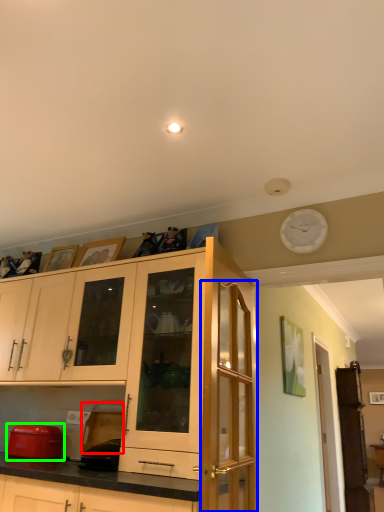
Question: Which is nearer to the appliance (highlighted by a red box)? glass door (highlighted by a blue box) or appliance (highlighted by a green box).

Choices:
 (A) glass door
 (B) appliance

Answer: (B)